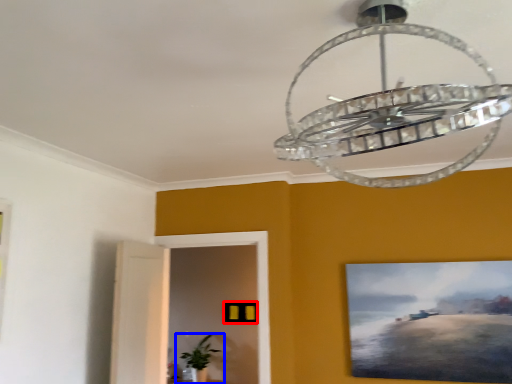
Question: Which object is closer to the camera taking this photo, picture frame (highlighted by a red box) or houseplant (highlighted by a blue box)?

Choices:
 (A) picture frame
 (B) houseplant

Answer: (B)